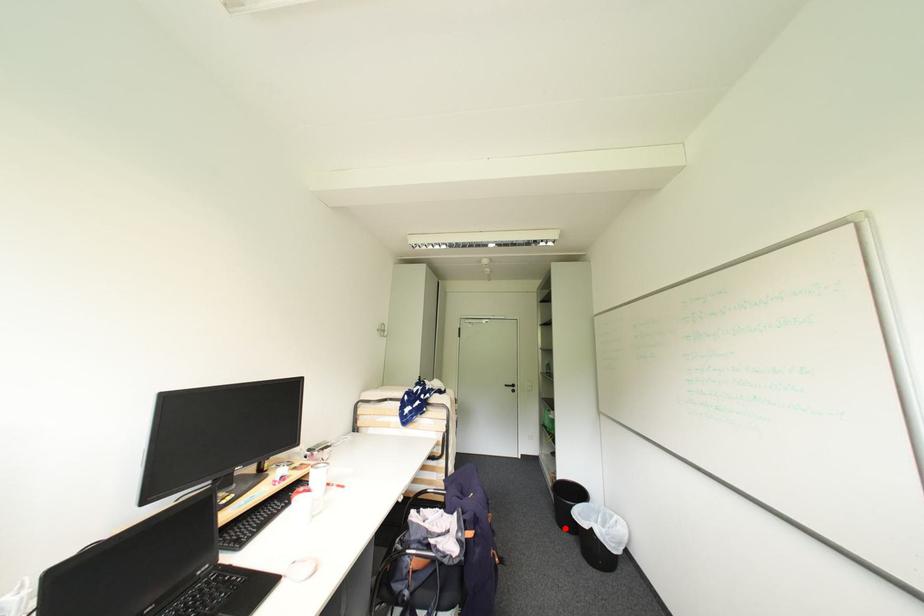
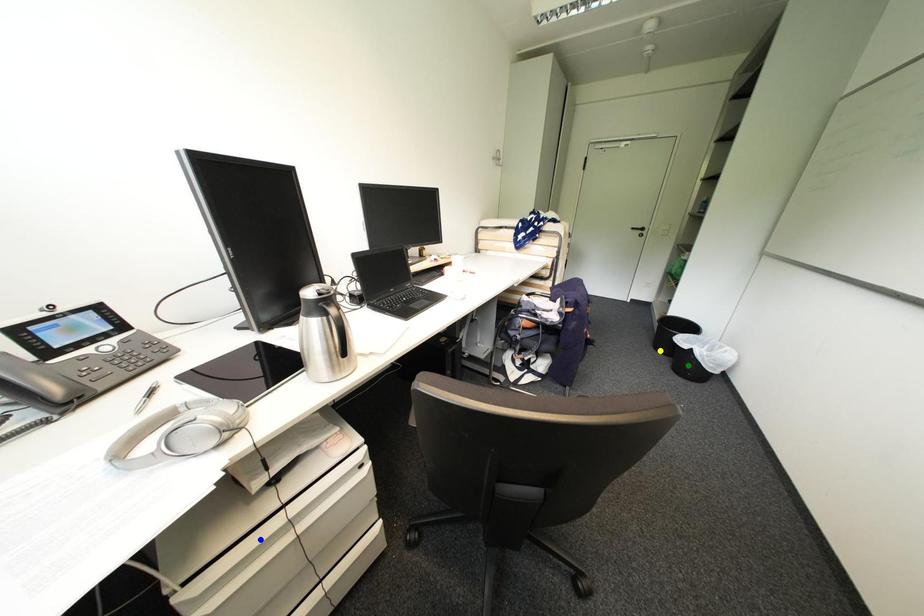
Question: I am providing you with two images of the same scene from different viewpoints. A red point is marked on the first image. You are given multiple points on the second image. Which spot in image 2 lines up with the point in image 1?

Choices:
 (A) blue point
 (B) green point
 (C) yellow point

Answer: (C)